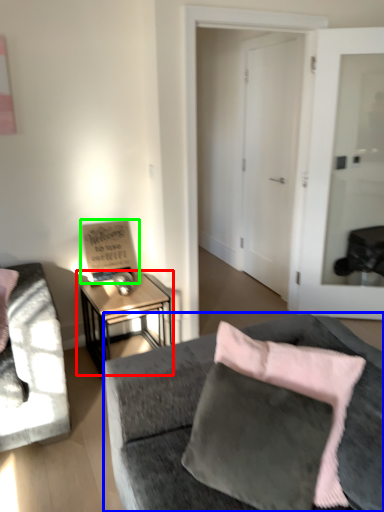
Question: Which is nearer to the table (highlighted by a red box)? studio couch (highlighted by a blue box) or bulletin board (highlighted by a green box).

Choices:
 (A) studio couch
 (B) bulletin board

Answer: (B)